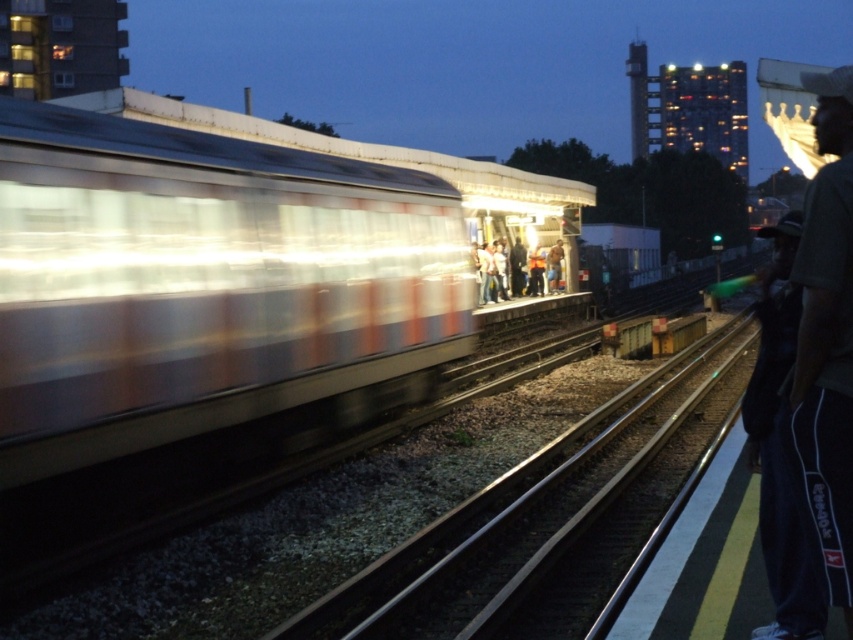
Who is positioned more to the right, dark gray reebok track pants at right or blue jeans at center?

Positioned to the right is dark gray reebok track pants at right.

Does dark gray reebok track pants at right have a greater width compared to blue jeans at center?

Indeed, dark gray reebok track pants at right has a greater width compared to blue jeans at center.

The image size is (853, 640). In order to click on dark gray reebok track pants at right in this screenshot , I will do `click(827, 339)`.

The height and width of the screenshot is (640, 853). I want to click on dark gray reebok track pants at right, so click(x=827, y=339).

Is metallic silver train at left to the right of blue jeans at center from the viewer's perspective?

In fact, metallic silver train at left is to the left of blue jeans at center.

Which is below, metallic silver train at left or blue jeans at center?

metallic silver train at left is below.

Identify the location of metallic silver train at left. Image resolution: width=853 pixels, height=640 pixels. (202, 282).

Between point (363, 253) and point (821, 224), which one is positioned in front?

Point (821, 224)

You are a GUI agent. You are given a task and a screenshot of the screen. Output one action in this format:
    pyautogui.click(x=<x>, y=<y>)
    Task: Click on the metallic silver train at left
    
    Given the screenshot: What is the action you would take?
    pyautogui.click(x=202, y=282)

The image size is (853, 640). What are the coordinates of `metallic silver train at left` in the screenshot? It's located at (202, 282).